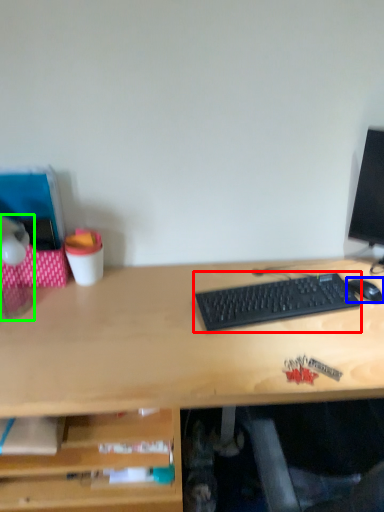
Question: Which object is the farthest from computer keyboard (highlighted by a red box)? Choose among these: mouse (highlighted by a blue box) or table lamp (highlighted by a green box).

Choices:
 (A) mouse
 (B) table lamp

Answer: (B)